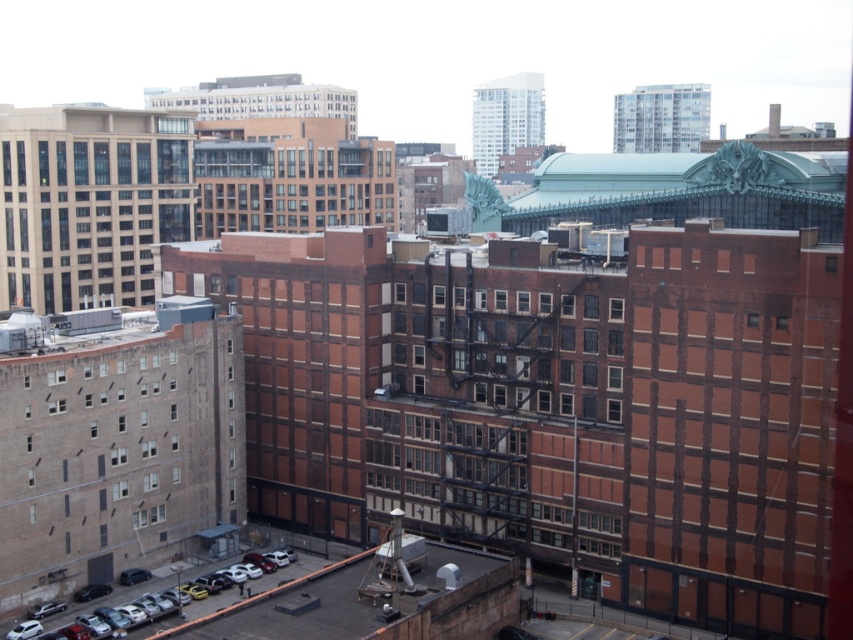
Based on the photo, does white matte car at lower left have a lesser height compared to white glass window at center?

No, white matte car at lower left is not shorter than white glass window at center.

Is white matte car at lower left smaller than white glass window at center?

Actually, white matte car at lower left might be larger than white glass window at center.

Is point (223, 563) farther from viewer compared to point (614, 305)?

Yes, it is behind point (614, 305).

Where is `white matte car at lower left`? The width and height of the screenshot is (853, 640). white matte car at lower left is located at coordinates (212, 604).